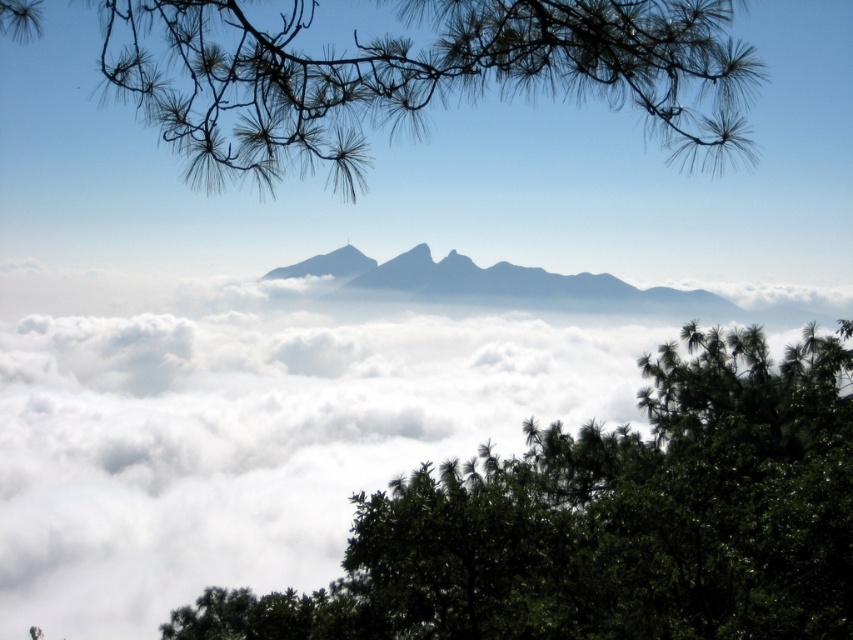
Who is more distant from viewer, (779, 561) or (335, 264)?

The point (335, 264) is more distant.

Is dark green leafy tree at center taller than gray rocky peak at center?

Indeed, dark green leafy tree at center has a greater height compared to gray rocky peak at center.

I want to click on dark green leafy tree at center, so click(x=608, y=520).

Where is `dark green leafy tree at center`? The height and width of the screenshot is (640, 853). dark green leafy tree at center is located at coordinates (608, 520).

Does blue foggy mountain at center come in front of gray rocky peak at center?

Yes, it is in front of gray rocky peak at center.

In the scene shown: Who is more distant from viewer, (490, 278) or (339, 262)?

The point (339, 262) is more distant.

Identify the location of blue foggy mountain at center. This screenshot has height=640, width=853. (520, 285).

Which is more to the left, dark green leafy tree at center or green needle-like branches at upper left?

green needle-like branches at upper left is more to the left.

Is dark green leafy tree at center below green needle-like branches at upper left?

Yes, dark green leafy tree at center is below green needle-like branches at upper left.

Does point (440, 620) come closer to viewer compared to point (314, 3)?

Yes, point (440, 620) is closer to viewer.

At what (x,y) coordinates should I click in order to perform the action: click on dark green leafy tree at center. Please return your answer as a coordinate pair (x, y). This screenshot has height=640, width=853. Looking at the image, I should click on (608, 520).